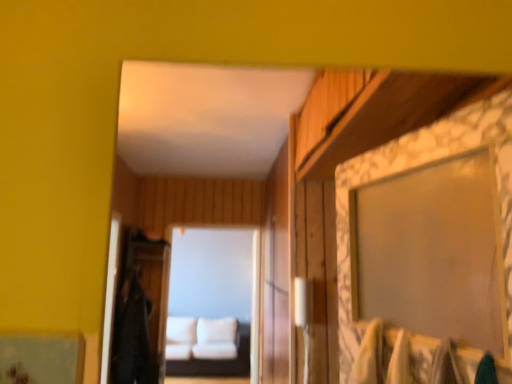
Question: Considering the positions of point (177, 372) and point (112, 354), is point (177, 372) closer or farther from the camera than point (112, 354)?

Choices:
 (A) closer
 (B) farther

Answer: (B)

Question: In terms of height, does white fabric couch at center look taller or shorter compared to black fabric robe at left?

Choices:
 (A) tall
 (B) short

Answer: (B)

Question: Estimate the real-world distances between objects in this image. Which object is closer to the white fabric couch at center?

Choices:
 (A) black fabric robe at left
 (B) white fabric couch at center

Answer: (B)

Question: Which is nearer to the white fabric couch at center?

Choices:
 (A) white fabric couch at center
 (B) black fabric robe at left

Answer: (A)